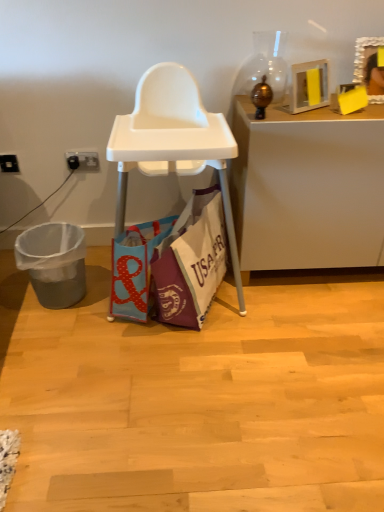
Question: From a real-world perspective, is wooden picture frame at upper right below white glossy desk at upper right?

Choices:
 (A) no
 (B) yes

Answer: (A)

Question: Considering the relative positions of wooden picture frame at upper right and white glossy desk at upper right in the image provided, is wooden picture frame at upper right to the right of white glossy desk at upper right from the viewer's perspective?

Choices:
 (A) no
 (B) yes

Answer: (B)

Question: From a real-world perspective, is wooden picture frame at upper right located higher than white glossy desk at upper right?

Choices:
 (A) no
 (B) yes

Answer: (B)

Question: Is wooden picture frame at upper right touching white glossy desk at upper right?

Choices:
 (A) no
 (B) yes

Answer: (A)

Question: Does wooden picture frame at upper right come behind white glossy desk at upper right?

Choices:
 (A) no
 (B) yes

Answer: (B)

Question: In terms of height, does wooden picture frame at upper right look taller or shorter compared to gray plastic trash can at lower left?

Choices:
 (A) tall
 (B) short

Answer: (B)

Question: From a real-world perspective, is wooden picture frame at upper right physically located above or below gray plastic trash can at lower left?

Choices:
 (A) below
 (B) above

Answer: (B)

Question: Is point (372, 41) positioned closer to the camera than point (59, 274)?

Choices:
 (A) farther
 (B) closer

Answer: (B)

Question: Based on their positions, is wooden picture frame at upper right located to the left or right of gray plastic trash can at lower left?

Choices:
 (A) left
 (B) right

Answer: (B)

Question: From the image's perspective, is white plastic power outlet at lower left, which is counted as the first power outlet, starting from the right, above or below white glossy desk at upper right?

Choices:
 (A) below
 (B) above

Answer: (B)

Question: Considering the relative positions of white plastic power outlet at lower left, the second power outlet when ordered from left to right, and white glossy desk at upper right in the image provided, is white plastic power outlet at lower left, the second power outlet when ordered from left to right, to the left or to the right of white glossy desk at upper right?

Choices:
 (A) left
 (B) right

Answer: (A)

Question: From a real-world perspective, is white plastic power outlet at lower left, the second power outlet when ordered from left to right, above or below white glossy desk at upper right?

Choices:
 (A) above
 (B) below

Answer: (A)

Question: Considering the positions of white plastic power outlet at lower left, the second power outlet when ordered from left to right, and white glossy desk at upper right in the image, is white plastic power outlet at lower left, the second power outlet when ordered from left to right, taller or shorter than white glossy desk at upper right?

Choices:
 (A) tall
 (B) short

Answer: (B)

Question: Is black plastic power outlet at lower left, the 2th power outlet in the right-to-left sequence, spatially inside white plastic power outlet at lower left, the second power outlet when ordered from left to right, or outside of it?

Choices:
 (A) outside
 (B) inside

Answer: (A)

Question: Would you say black plastic power outlet at lower left, the 2th power outlet in the right-to-left sequence, is to the left or to the right of white plastic power outlet at lower left, which is counted as the first power outlet, starting from the right, in the picture?

Choices:
 (A) left
 (B) right

Answer: (A)